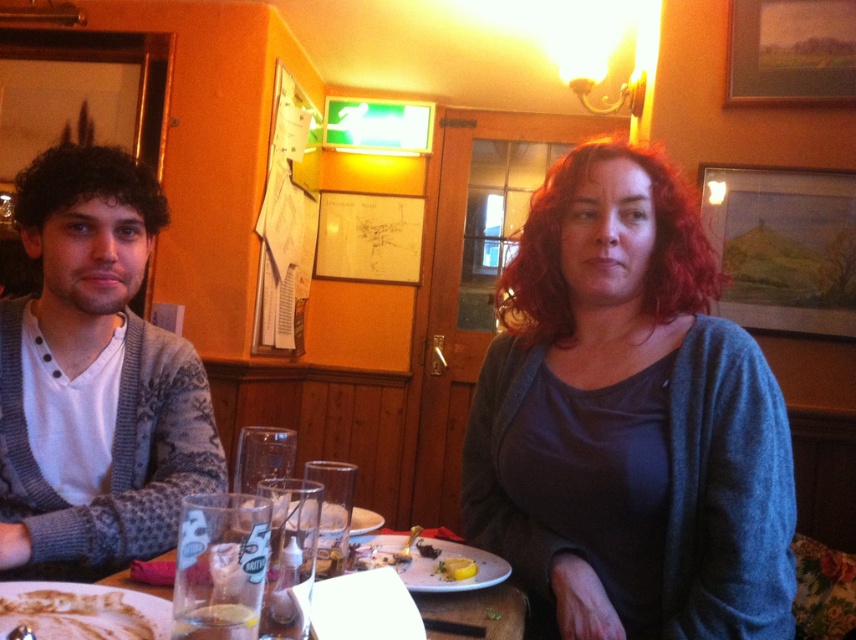
Question: Among these points, which one is farthest from the camera?

Choices:
 (A) (450, 573)
 (B) (67, 508)

Answer: (B)

Question: Does knitted gray sweater at left appear on the left side of white creamy cake at lower left?

Choices:
 (A) no
 (B) yes

Answer: (B)

Question: Is knitted gray sweater at left wider than yellow matte lemon at lower center?

Choices:
 (A) no
 (B) yes

Answer: (B)

Question: Which object is positioned closest to the knitted gray sweater at left?

Choices:
 (A) dark gray sweater at center
 (B) yellow matte lemon at lower center

Answer: (A)

Question: Which is farther from the dark gray sweater at center?

Choices:
 (A) yellow matte lemon at lower center
 (B) white creamy cake at lower left

Answer: (B)

Question: Is knitted gray sweater at left below white creamy cake at lower left?

Choices:
 (A) yes
 (B) no

Answer: (B)